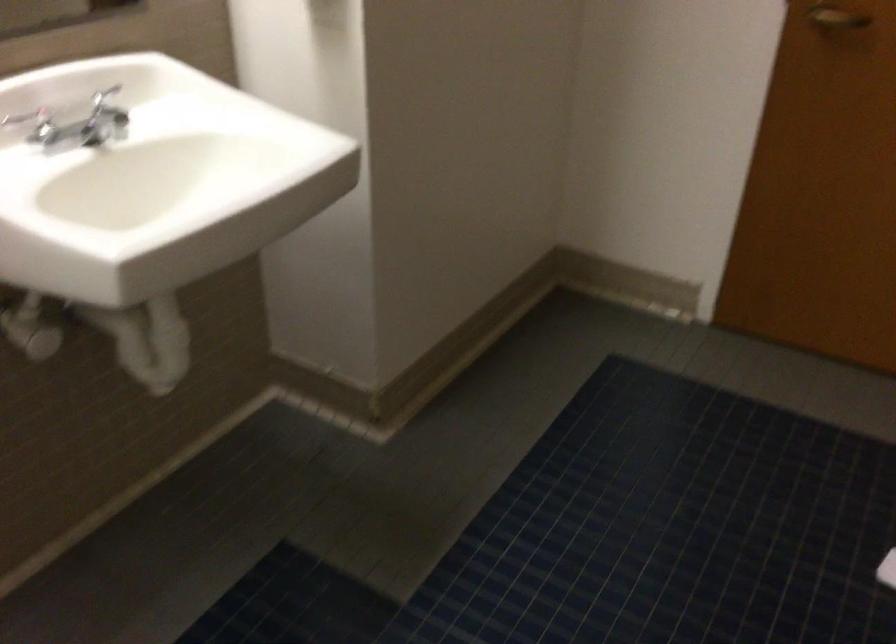
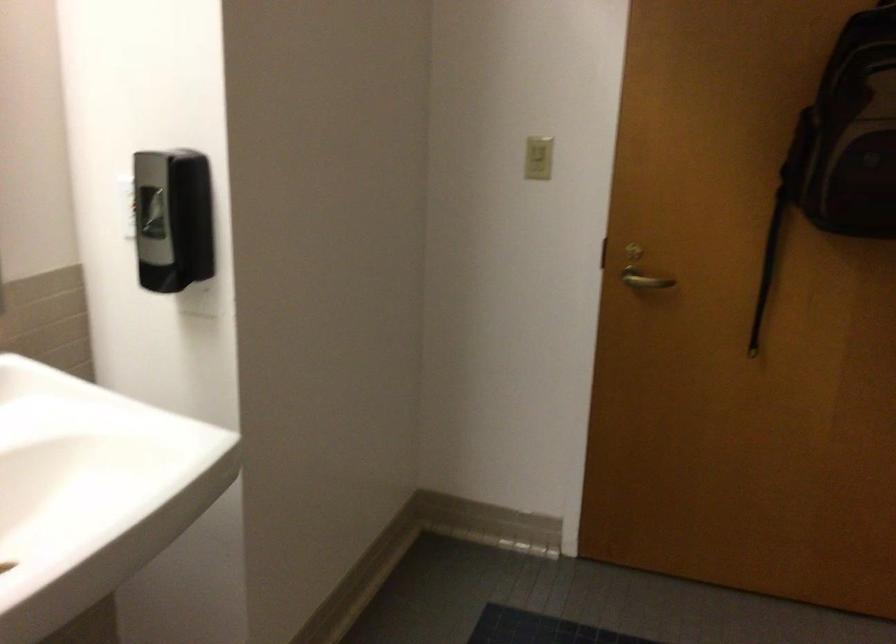
Question: Based on the continuous images, in which direction is the camera rotating? Reply with the corresponding letter.

Choices:
 (A) Left
 (B) Right
 (C) Up
 (D) Down

Answer: (C)